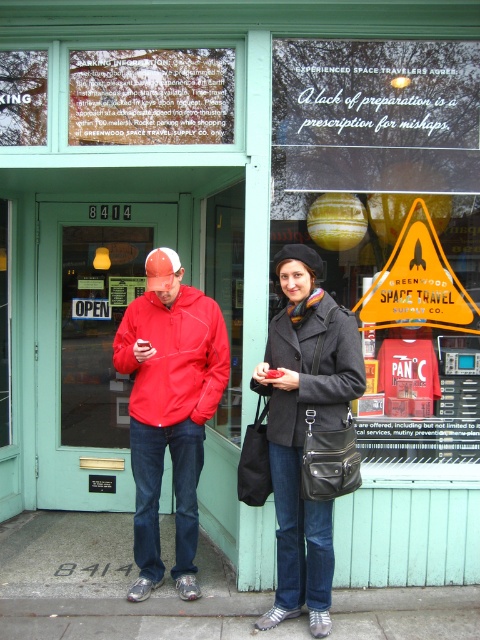
Does red matte jacket at center have a lesser height compared to matte black coat at center?

In fact, red matte jacket at center may be taller than matte black coat at center.

Who is higher up, red matte jacket at center or matte black coat at center?

red matte jacket at center

Is point (312, 269) more distant than point (271, 346)?

No, (312, 269) is closer to viewer.

Image resolution: width=480 pixels, height=640 pixels. In order to click on red matte jacket at center in this screenshot , I will do `click(304, 428)`.

Between point (134, 301) and point (146, 493), which one is positioned behind?

The point (134, 301) is behind.

Between red matte jacket at center and red fleece jacket at center, which one has more height?

red matte jacket at center

Between point (340, 310) and point (192, 579), which one is positioned behind?

Point (192, 579)

Identify the location of red matte jacket at center. This screenshot has width=480, height=640. (304, 428).

Is red fleece jacket at center below matte black coat at center?

Actually, red fleece jacket at center is above matte black coat at center.

Can you confirm if red fleece jacket at center is positioned to the left of matte black coat at center?

Yes, red fleece jacket at center is to the left of matte black coat at center.

Which is behind, point (168, 364) or point (294, 460)?

The point (168, 364) is behind.

Image resolution: width=480 pixels, height=640 pixels. In order to click on red fleece jacket at center in this screenshot , I will do `click(169, 410)`.